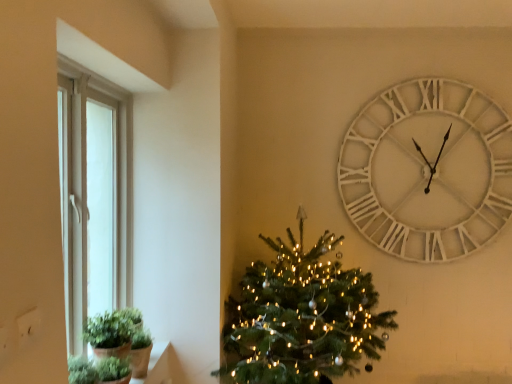
Question: Is green matte plant at lower left completely or partially outside of green matte plant at lower left?

Choices:
 (A) yes
 (B) no

Answer: (A)

Question: Does green matte plant at lower left have a lesser height compared to green matte plant at lower left?

Choices:
 (A) no
 (B) yes

Answer: (A)

Question: Could you tell me if green matte plant at lower left is facing green matte plant at lower left?

Choices:
 (A) no
 (B) yes

Answer: (A)

Question: From the image's perspective, does green matte plant at lower left appear higher than green matte plant at lower left?

Choices:
 (A) yes
 (B) no

Answer: (A)

Question: Can you confirm if green matte plant at lower left is thinner than green matte plant at lower left?

Choices:
 (A) no
 (B) yes

Answer: (A)

Question: Considering their positions, is green matte plant at lower left located in front of or behind green matte plant at lower left?

Choices:
 (A) front
 (B) behind

Answer: (B)

Question: Visually, is green matte plant at lower left positioned to the left or to the right of green matte plant at lower left?

Choices:
 (A) right
 (B) left

Answer: (B)

Question: From the image's perspective, is green matte plant at lower left positioned above or below green matte plant at lower left?

Choices:
 (A) below
 (B) above

Answer: (B)

Question: In terms of width, does green matte plant at lower left look wider or thinner when compared to green matte plant at lower left?

Choices:
 (A) wide
 (B) thin

Answer: (A)

Question: Is green matte christmas tree at center wider or thinner than white wooden clock at upper right?

Choices:
 (A) wide
 (B) thin

Answer: (A)

Question: Is green matte christmas tree at center situated inside white wooden clock at upper right or outside?

Choices:
 (A) inside
 (B) outside

Answer: (B)

Question: Does point (362, 307) appear closer or farther from the camera than point (406, 150)?

Choices:
 (A) closer
 (B) farther

Answer: (A)

Question: Is green matte christmas tree at center in front of or behind white wooden clock at upper right in the image?

Choices:
 (A) front
 (B) behind

Answer: (A)

Question: Considering the positions of green matte plant at lower left and green matte christmas tree at center in the image, is green matte plant at lower left wider or thinner than green matte christmas tree at center?

Choices:
 (A) thin
 (B) wide

Answer: (A)

Question: Is point (123, 365) positioned closer to the camera than point (212, 375)?

Choices:
 (A) farther
 (B) closer

Answer: (B)